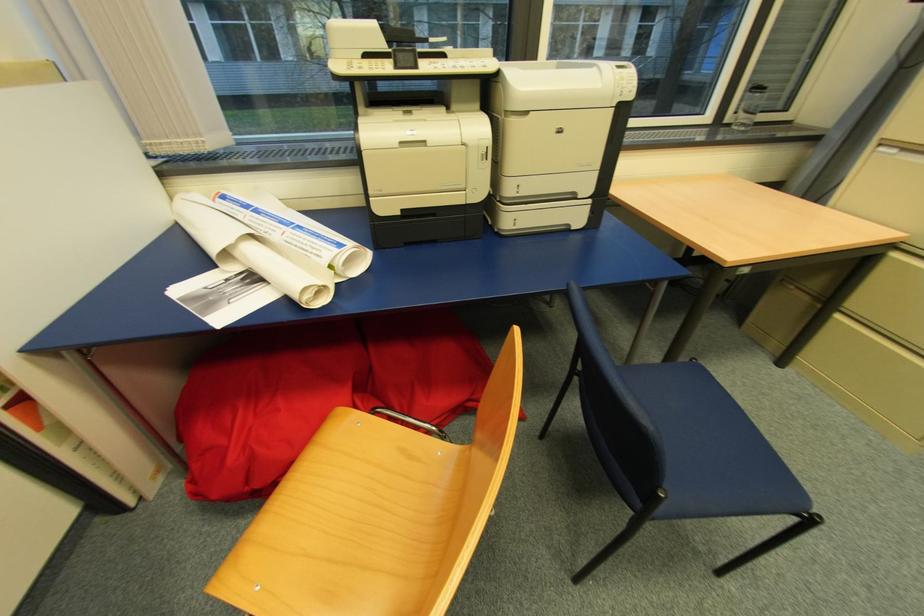
At what (x,y) coordinates should I click in order to perform the action: click on wooden chair sitting surface. Please return your answer as a coordinate pair (x, y). This screenshot has width=924, height=616. Looking at the image, I should click on (361, 515).